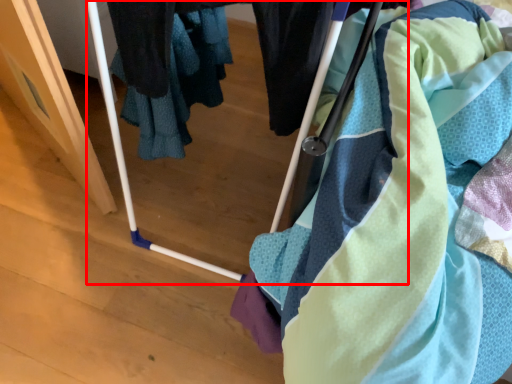
Question: In this image, where is baby carriage (annotated by the red box) located relative to towel?

Choices:
 (A) left
 (B) right

Answer: (B)